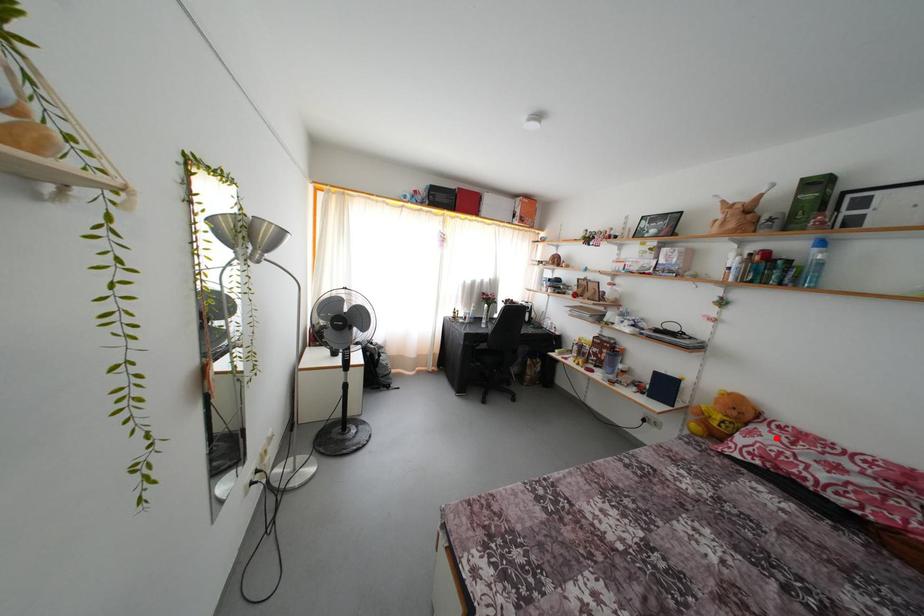
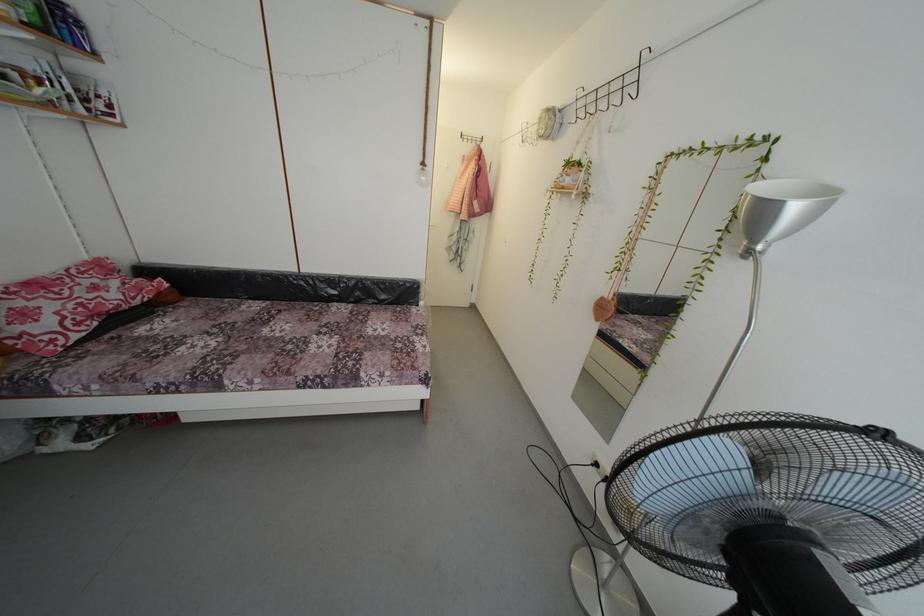
Question: I am providing you with two images of the same scene from different viewpoints. Image1 has a red point marked. In image2, the corresponding 3D location appears at what relative position? Reply with the corresponding letter.

Choices:
 (A) Closer
 (B) Farther

Answer: (B)